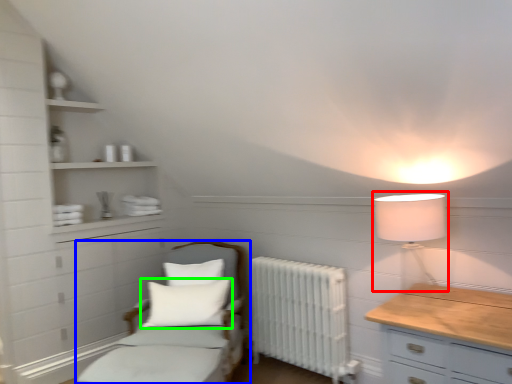
Question: Estimate the real-world distances between objects in this image. Which object is farther from table lamp (highlighted by a red box), furniture (highlighted by a blue box) or pillow (highlighted by a green box)?

Choices:
 (A) furniture
 (B) pillow

Answer: (B)